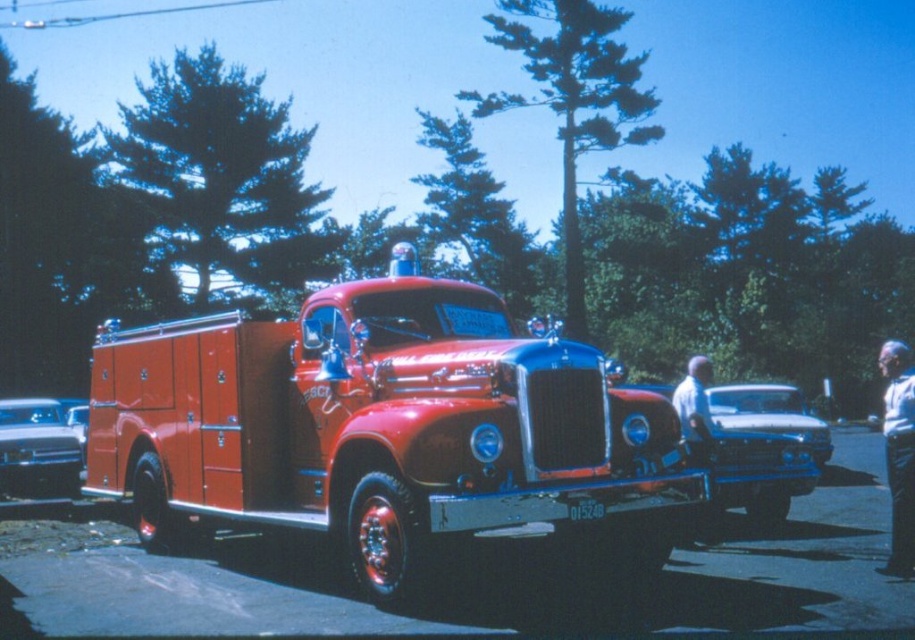
Question: Does shiny silver sedan at left appear over shiny blue car at center?

Choices:
 (A) yes
 (B) no

Answer: (B)

Question: Based on their relative distances, which object is nearer to the shiny red fire truck at center?

Choices:
 (A) shiny blue car at center
 (B) metallic red fire truck at center
 (C) shiny silver sedan at left

Answer: (B)

Question: Considering the real-world distances, which object is farthest from the shiny blue car at center?

Choices:
 (A) shiny silver sedan at left
 (B) metallic red fire truck at center

Answer: (A)

Question: Which of the following is the farthest from the observer?

Choices:
 (A) metallic red fire truck at center
 (B) shiny silver sedan at left

Answer: (B)

Question: Is shiny red fire truck at center bigger than shiny silver sedan at left?

Choices:
 (A) no
 (B) yes

Answer: (B)

Question: Can you confirm if shiny red fire truck at center is smaller than shiny blue car at center?

Choices:
 (A) no
 (B) yes

Answer: (A)